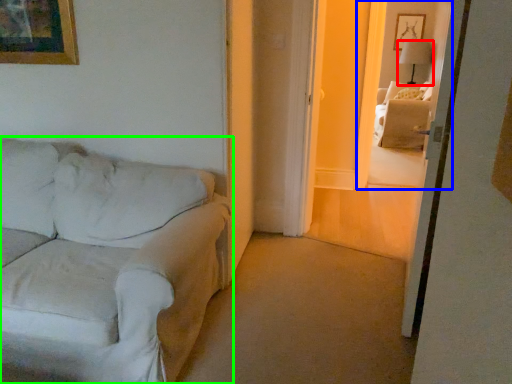
Question: Which is farther away from lamp (highlighted by a red box)? window (highlighted by a blue box) or studio couch (highlighted by a green box)?

Choices:
 (A) window
 (B) studio couch

Answer: (B)